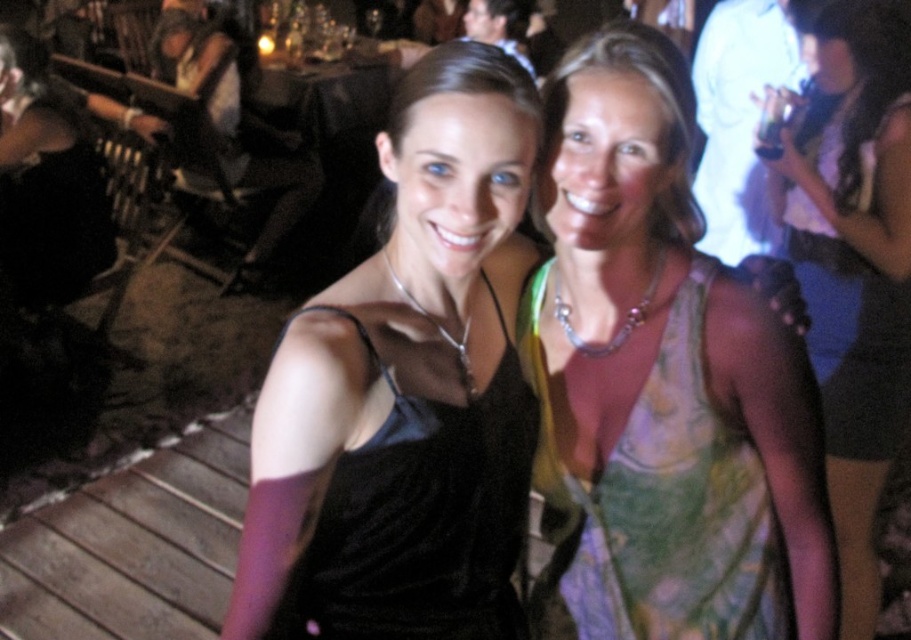
You are a photographer at the event and need to adjust the lighting so that both the green floral dress at center and the green floral dress at upper right are well lit. Which dress should you focus on first to ensure the one closer to the camera is properly illuminated?

The green floral dress at upper right is closer to the camera than the green floral dress at center, so you should focus on lighting the green floral dress at upper right first to ensure proper illumination.

You are at a social event and see two women posing. The woman on the left is wearing a sleeveless black dress with a red arm band on her right arm. The woman on the right has blonde hair and is wearing a sleeveless top. There is a point marked at coordinates [855,266]. What is located at that point?

The point at [855,266] has the green floral dress at center.